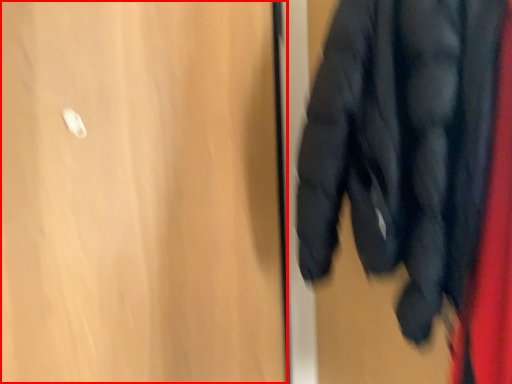
Question: In this image, where is door (annotated by the red box) located relative to jacket?

Choices:
 (A) right
 (B) left

Answer: (B)